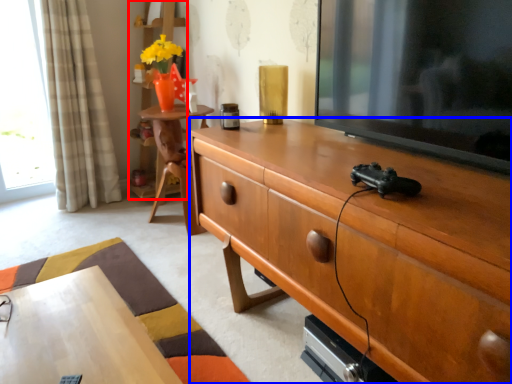
Question: Which object is closer to the camera taking this photo, bookshelf (highlighted by a red box) or cabinetry (highlighted by a blue box)?

Choices:
 (A) bookshelf
 (B) cabinetry

Answer: (B)